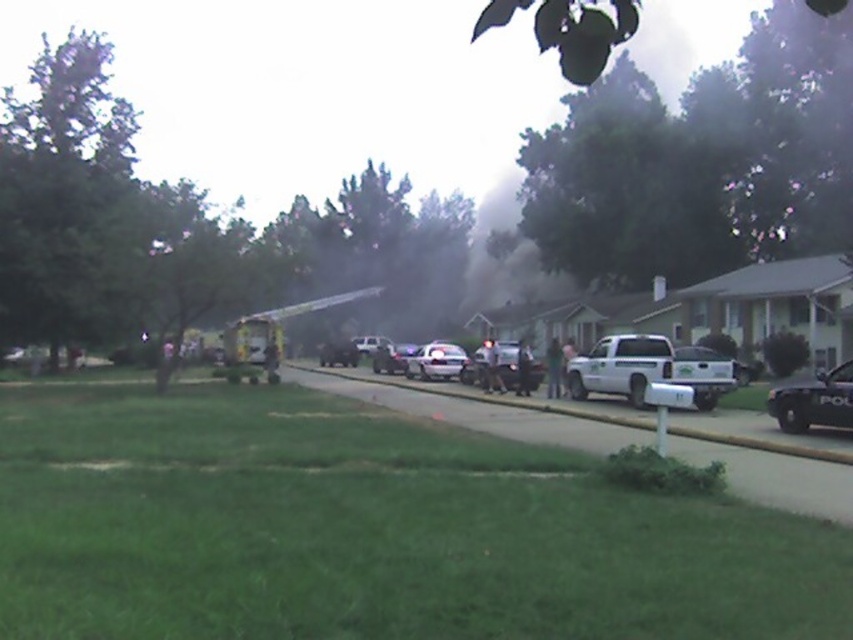
Who is lower down, white matte truck at right or black matte police car at lower right?

black matte police car at lower right

Does white matte truck at right appear under black matte police car at lower right?

Actually, white matte truck at right is above black matte police car at lower right.

Is point (656, 353) behind point (827, 406)?

That is True.

Find the location of a particular element. The height and width of the screenshot is (640, 853). white matte truck at right is located at coordinates (648, 369).

Is green grass at lower left below smooth concrete curb at lower center?

No, green grass at lower left is not below smooth concrete curb at lower center.

Between green grass at lower left and smooth concrete curb at lower center, which one appears on the right side from the viewer's perspective?

From the viewer's perspective, smooth concrete curb at lower center appears more on the right side.

What do you see at coordinates (368, 529) in the screenshot? The height and width of the screenshot is (640, 853). I see `green grass at lower left` at bounding box center [368, 529].

Find the location of `green grass at lower left`. green grass at lower left is located at coordinates (368, 529).

Which is below, smooth concrete curb at lower center or black matte police car at lower right?

smooth concrete curb at lower center

Is point (747, 436) closer to camera compared to point (839, 420)?

That is False.

Describe the element at coordinates (489, 397) in the screenshot. I see `smooth concrete curb at lower center` at that location.

Find the location of a particular element. The width and height of the screenshot is (853, 640). smooth concrete curb at lower center is located at coordinates (489, 397).